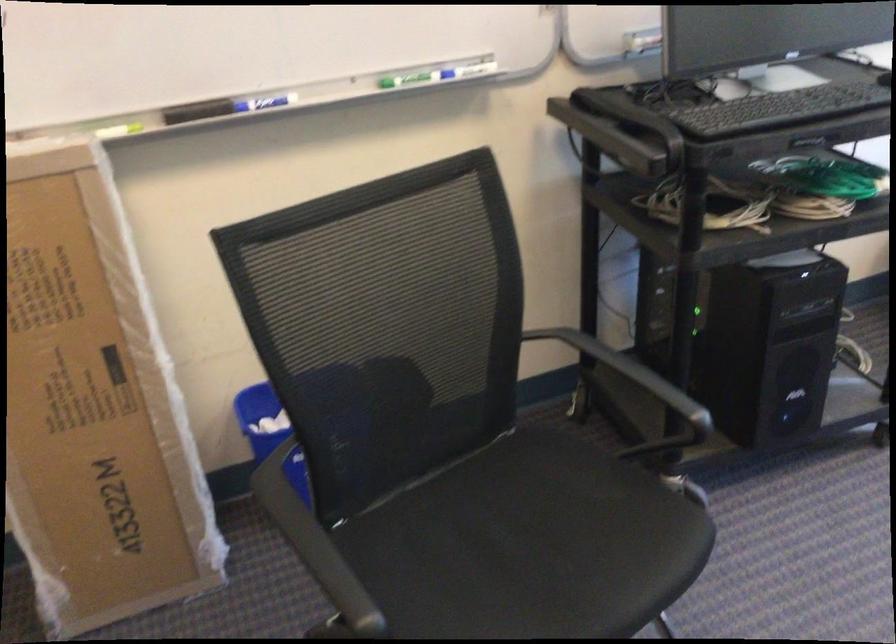
Find the location of a particular element. black chair sitting surface is located at coordinates (530, 545).